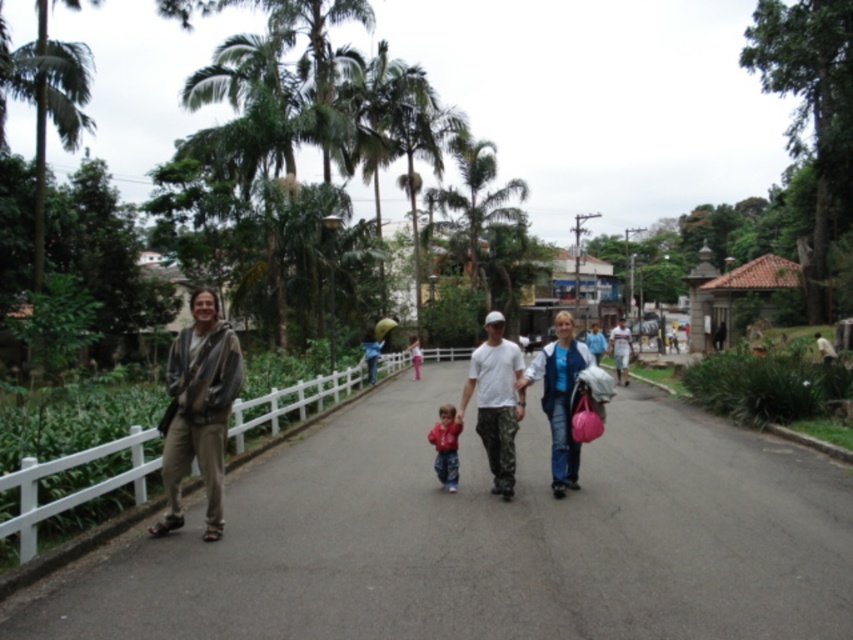
Who is taller, asphalt road at center or green leafy palm tree at center?

green leafy palm tree at center is taller.

Which is in front, point (233, 637) or point (489, 180)?

Positioned in front is point (233, 637).

Where is `asphalt road at center`? Image resolution: width=853 pixels, height=640 pixels. asphalt road at center is located at coordinates (486, 540).

Between brown textured jacket at left and white cotton shirt at center, which one has less height?

Standing shorter between the two is brown textured jacket at left.

Does brown textured jacket at left appear over white cotton shirt at center?

No, brown textured jacket at left is not above white cotton shirt at center.

Does point (207, 330) lie behind point (614, 371)?

No, it is in front of (614, 371).

At what (x,y) coordinates should I click in order to perform the action: click on brown textured jacket at left. Please return your answer as a coordinate pair (x, y). The width and height of the screenshot is (853, 640). Looking at the image, I should click on (198, 410).

Is asphalt road at center to the right of brown textured jacket at left from the viewer's perspective?

Correct, you'll find asphalt road at center to the right of brown textured jacket at left.

Is point (613, 465) behind point (206, 456)?

Yes, point (613, 465) is behind point (206, 456).

Locate an element on the screen. This screenshot has width=853, height=640. asphalt road at center is located at coordinates (486, 540).